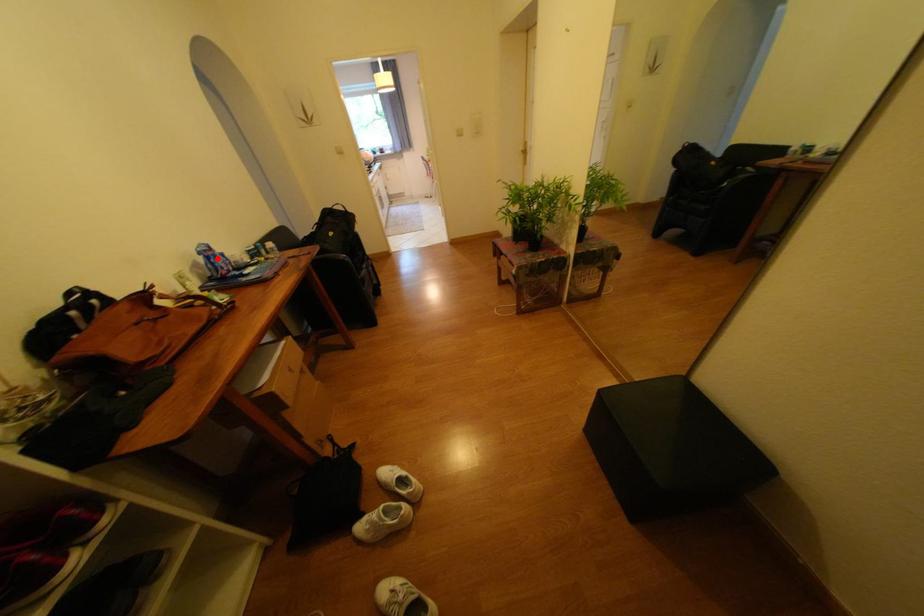
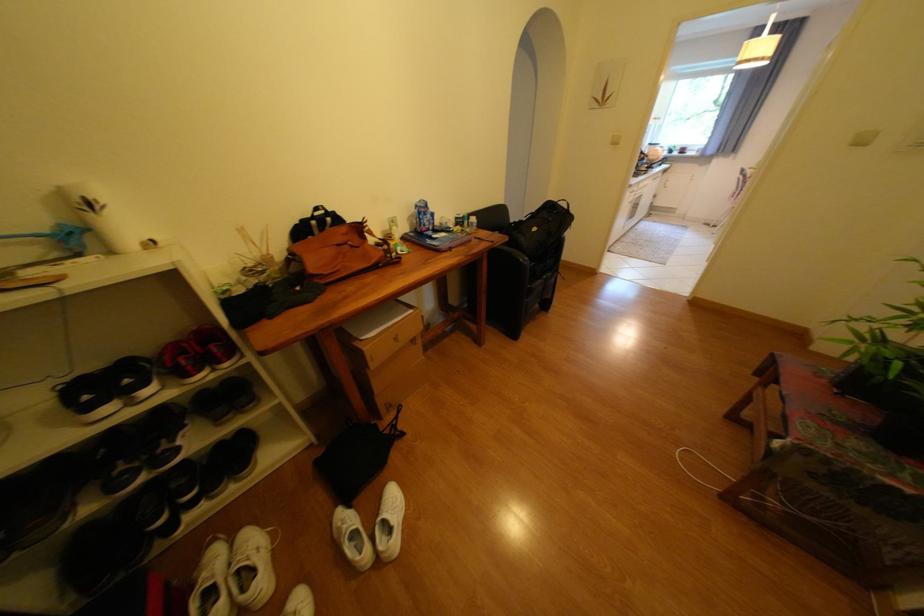
Where in the second image is the point corresponding to the highlighted location from the first image?

(429, 214)